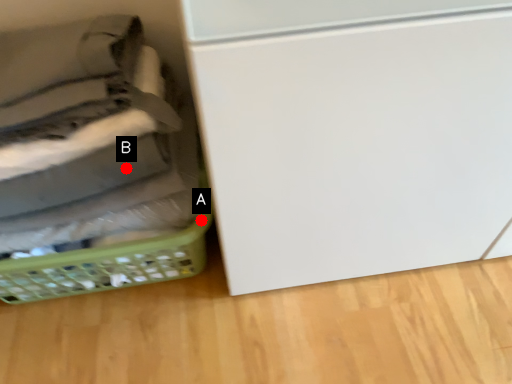
Question: Two points are circled on the image, labeled by A and B beside each circle. Which point is farther to the camera?

Choices:
 (A) A is further
 (B) B is further

Answer: (A)